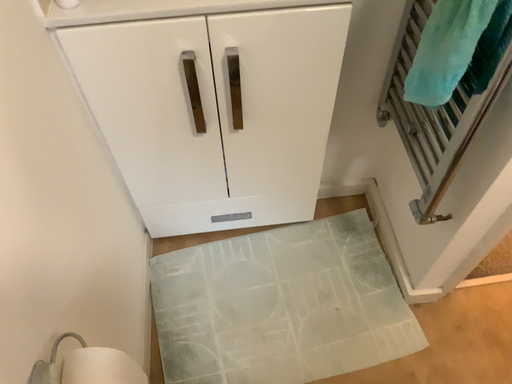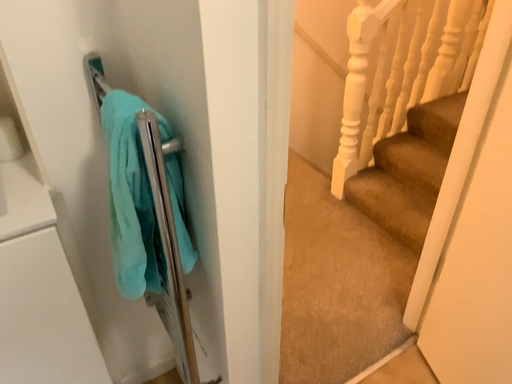
Question: Which way did the camera rotate in the video?

Choices:
 (A) rotated upward
 (B) rotated downward

Answer: (A)